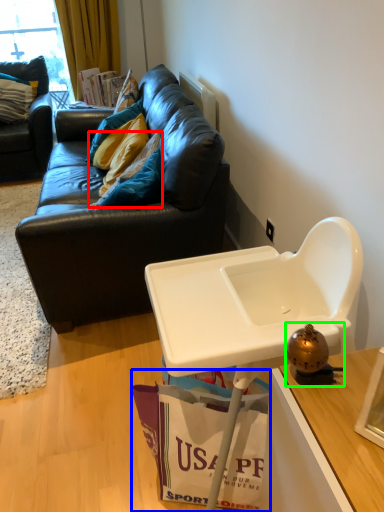
Question: Which object is the closest to the pillow (highlighted by a red box)? Choose among these: shopping bag (highlighted by a blue box) or toy (highlighted by a green box).

Choices:
 (A) shopping bag
 (B) toy

Answer: (A)